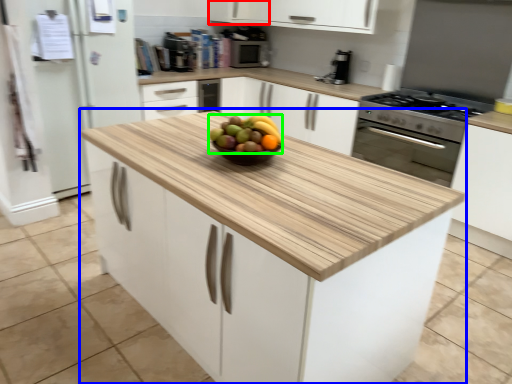
Question: Estimate the real-world distances between objects in this image. Which object is farther from cabinetry (highlighted by a red box), cabinetry (highlighted by a blue box) or grapefruit (highlighted by a green box)?

Choices:
 (A) cabinetry
 (B) grapefruit

Answer: (A)